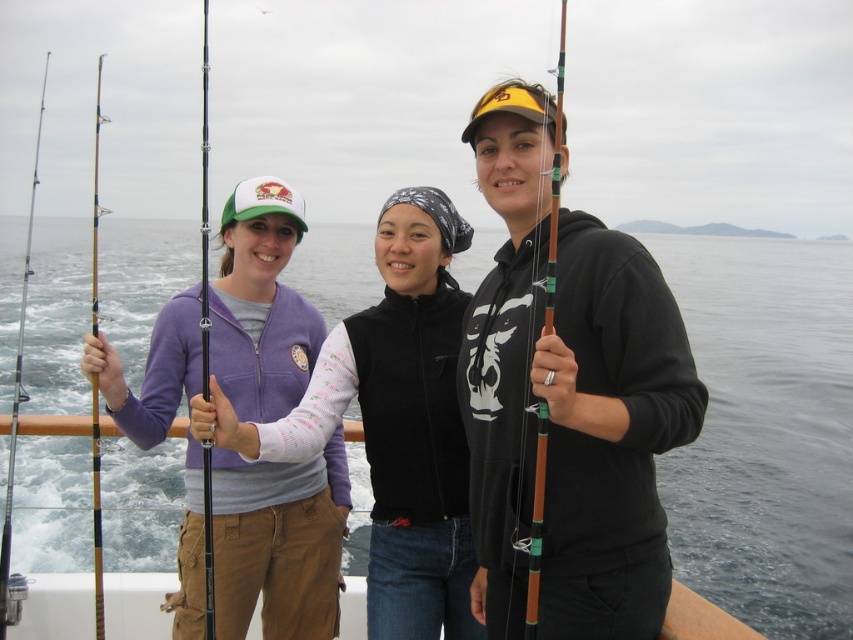
Who is more forward, (123, 268) or (91, 259)?

Positioned in front is point (123, 268).

Locate an element on the screen. The height and width of the screenshot is (640, 853). clear water at center is located at coordinates (764, 432).

Looking at this image, measure the distance from matte purple fleece at center to brown fabric boat at lower center.

matte purple fleece at center is 1.68 meters from brown fabric boat at lower center.

Can you confirm if matte purple fleece at center is shorter than brown fabric boat at lower center?

Incorrect, matte purple fleece at center's height does not fall short of brown fabric boat at lower center's.

Locate an element on the screen. matte purple fleece at center is located at coordinates (395, 420).

Which of these two, matte purple fleece at center or wooden fishing pole at left, stands shorter?

With less height is matte purple fleece at center.

Between point (334, 340) and point (97, 237), which one is positioned in front?

Point (334, 340)

Is point (236, 445) positioned in front of point (102, 632)?

Yes, point (236, 445) is closer to viewer.

The width and height of the screenshot is (853, 640). I want to click on matte purple fleece at center, so click(395, 420).